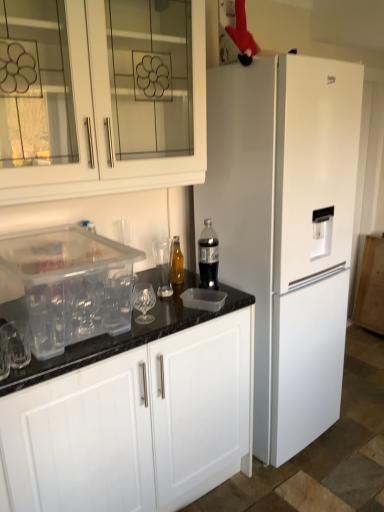
Question: Relative to transparent plastic container at lower left, is clear plastic container at lower left, the 1th cabinetry ordered from the bottom, in front or behind?

Choices:
 (A) behind
 (B) front

Answer: (B)

Question: Is clear plastic container at lower left, the 2th cabinetry when ordered from top to bottom, bigger or smaller than transparent plastic container at lower left?

Choices:
 (A) small
 (B) big

Answer: (B)

Question: Estimate the real-world distances between objects in this image. Which object is closer to the clear plastic container at lower left, the 2th cabinetry when ordered from top to bottom?

Choices:
 (A) white matte refrigerator at right
 (B) translucent plastic bottle at center, arranged as the 2th bottle when viewed from the left
 (C) white glass cabinet at upper left, which is counted as the 2th cabinetry, starting from the bottom
 (D) translucent glass bottle at center, the second bottle in the front-to-back sequence
 (E) transparent plastic container at lower left

Answer: (E)

Question: Estimate the real-world distances between objects in this image. Which object is farther from the translucent glass bottle at center, the second bottle in the front-to-back sequence?

Choices:
 (A) white matte refrigerator at right
 (B) transparent plastic container at lower left
 (C) white glass cabinet at upper left, arranged as the first cabinetry when viewed from the top
 (D) clear plastic container at lower left, the 1th cabinetry ordered from the bottom
 (E) translucent plastic bottle at center, positioned as the 1th bottle in front-to-back order

Answer: (D)